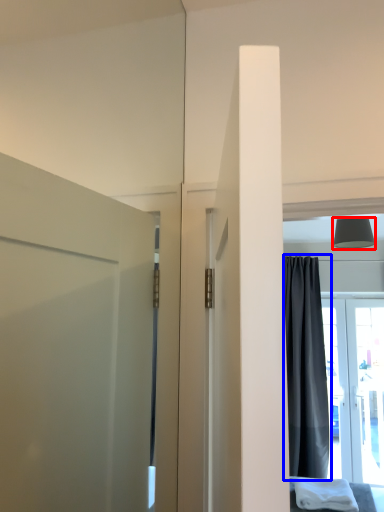
Question: Which point is closer to the camera, lamp (highlighted by a red box) or curtain (highlighted by a blue box)?

Choices:
 (A) lamp
 (B) curtain

Answer: (A)